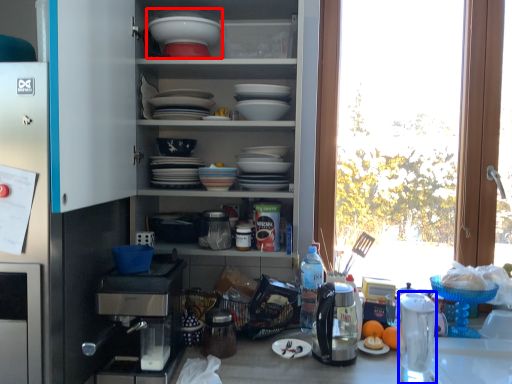
Question: Among these objects, which one is farthest to the camera, appliance (highlighted by a red box) or appliance (highlighted by a blue box)?

Choices:
 (A) appliance
 (B) appliance

Answer: (A)